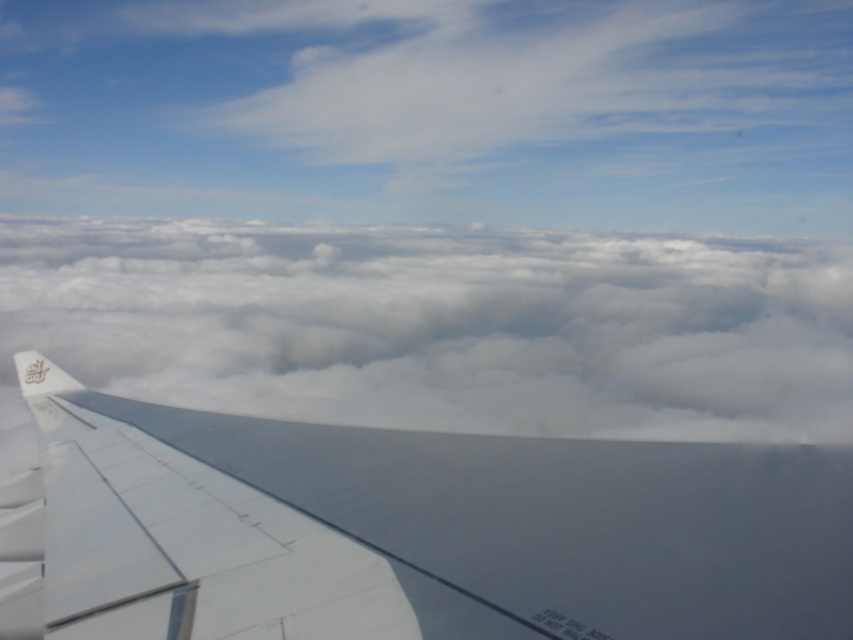
Based on the photo, how distant is white matte wing at center from white fluffy cloud at center?

white matte wing at center is 370.55 meters away from white fluffy cloud at center.

Which is behind, point (372, 506) or point (357, 298)?

The point (357, 298) is more distant.

Find the location of `white matte wing at center`. white matte wing at center is located at coordinates (409, 531).